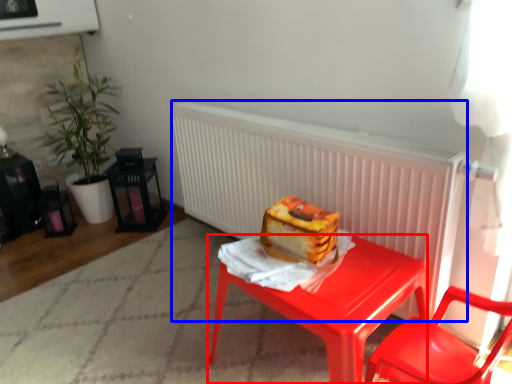
Question: Which object is closer to the camera taking this photo, desk (highlighted by a red box) or radiator (highlighted by a blue box)?

Choices:
 (A) desk
 (B) radiator

Answer: (A)